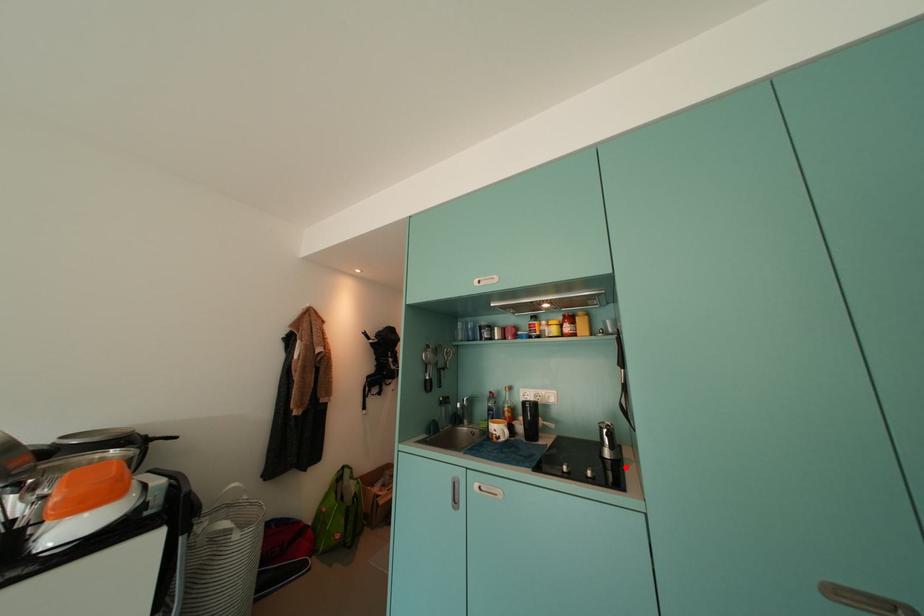
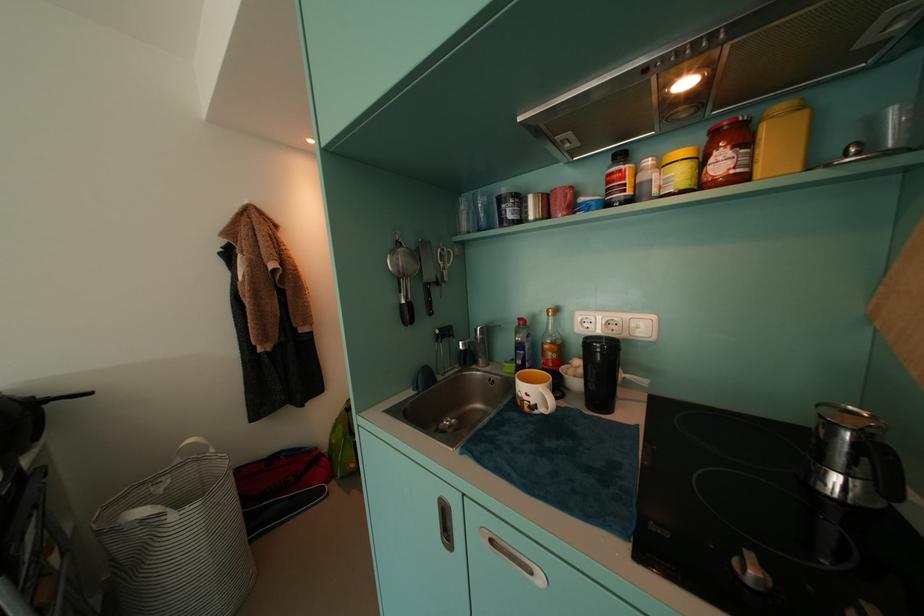
The point at the highlighted location is marked in the first image. Where is the corresponding point in the second image?

(891, 525)